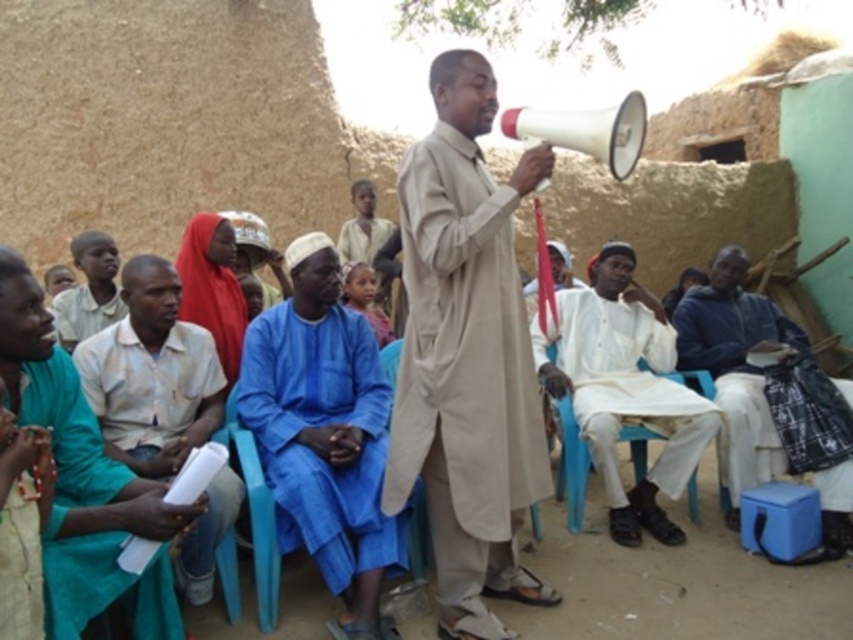
Question: In this image, where is beige fabric coat at center located relative to teal fabric robe at lower left?

Choices:
 (A) right
 (B) left

Answer: (A)

Question: Which object is the closest to the blue cotton shirt at center?

Choices:
 (A) beige fabric coat at center
 (B) white cotton shirt at left
 (C) teal fabric robe at lower left
 (D) white matte jacket at right

Answer: (B)

Question: Which point is farther to the camera?

Choices:
 (A) beige fabric coat at center
 (B) teal fabric robe at lower left
 (C) white matte jacket at right
 (D) blue cotton shirt at center

Answer: (C)

Question: Does white cotton shirt at center lie in front of teal fabric robe at lower left?

Choices:
 (A) no
 (B) yes

Answer: (A)

Question: Which point is farther to the camera?

Choices:
 (A) beige fabric coat at center
 (B) teal fabric robe at lower left
 (C) white matte jacket at right
 (D) light blue fabric at lower left

Answer: (D)

Question: Is teal fabric robe at lower left bigger than white matte jacket at right?

Choices:
 (A) no
 (B) yes

Answer: (A)